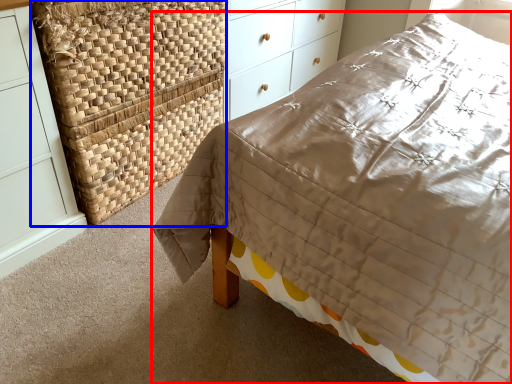
Question: Which of the following is the closest to the observer, bed (highlighted by a red box) or basket (highlighted by a blue box)?

Choices:
 (A) bed
 (B) basket

Answer: (A)